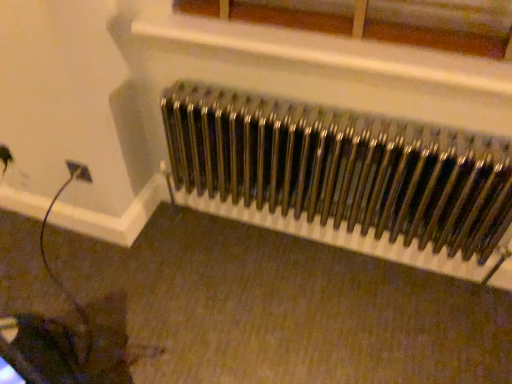
Question: Is metallic white radiator at upper center closer to the viewer compared to metallic radiator at center?

Choices:
 (A) yes
 (B) no

Answer: (A)

Question: From a real-world perspective, is metallic white radiator at upper center under metallic radiator at center?

Choices:
 (A) no
 (B) yes

Answer: (A)

Question: From the image's perspective, would you say metallic white radiator at upper center is shown under metallic radiator at center?

Choices:
 (A) yes
 (B) no

Answer: (B)

Question: Is metallic white radiator at upper center to the left of metallic radiator at center from the viewer's perspective?

Choices:
 (A) no
 (B) yes

Answer: (B)

Question: Can you confirm if metallic white radiator at upper center is shorter than metallic radiator at center?

Choices:
 (A) no
 (B) yes

Answer: (B)

Question: Can you confirm if metallic white radiator at upper center is taller than metallic radiator at center?

Choices:
 (A) yes
 (B) no

Answer: (B)

Question: Is metallic radiator at center not close to metallic white radiator at upper center?

Choices:
 (A) yes
 (B) no

Answer: (B)

Question: From the image's perspective, is metallic radiator at center under metallic white radiator at upper center?

Choices:
 (A) yes
 (B) no

Answer: (A)

Question: Can you confirm if metallic radiator at center is positioned to the right of metallic white radiator at upper center?

Choices:
 (A) yes
 (B) no

Answer: (A)

Question: Is metallic radiator at center placed right next to metallic white radiator at upper center?

Choices:
 (A) yes
 (B) no

Answer: (B)

Question: Does metallic radiator at center come in front of metallic white radiator at upper center?

Choices:
 (A) yes
 (B) no

Answer: (B)

Question: Is metallic radiator at center thinner than metallic white radiator at upper center?

Choices:
 (A) no
 (B) yes

Answer: (A)

Question: Is metallic radiator at center taller or shorter than metallic white radiator at upper center?

Choices:
 (A) tall
 (B) short

Answer: (A)